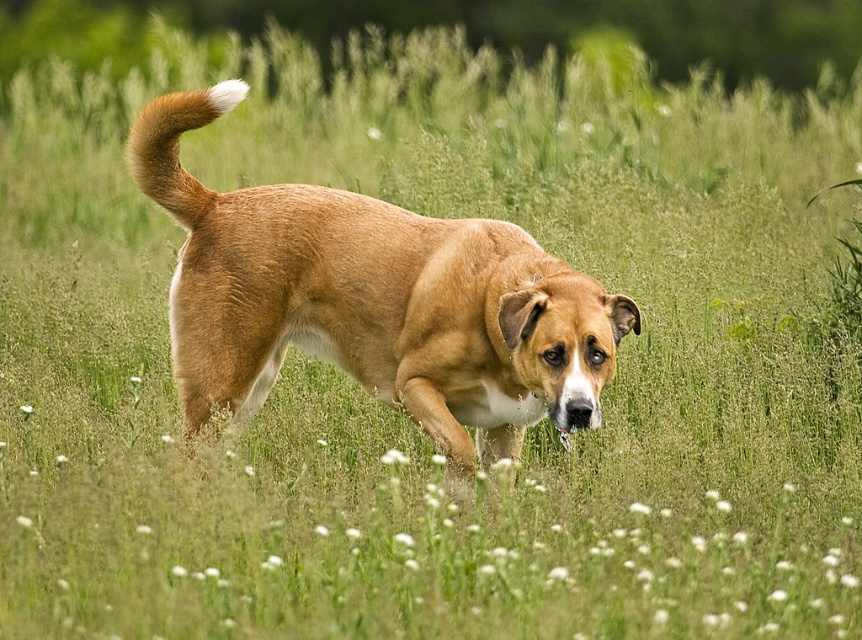
You are a photographer trying to capture the golden fur dog at center and the golden fur tail at upper left in a single shot. Based on their positions, which object should you adjust your camera focus to first to ensure both are in frame?

The golden fur dog at center is to the right of golden fur tail at upper left. To ensure both are in frame, adjust focus to the golden fur tail at upper left first, then pan the camera to include the golden fur dog at center.

You are a photographer trying to capture the golden fur dog at center and the golden fur tail at upper left in the image. Since both have similar colors, how can you distinguish them based on their size?

The golden fur dog at center is taller than the golden fur tail at upper left, so the larger one is the dog and the smaller one is the tail.